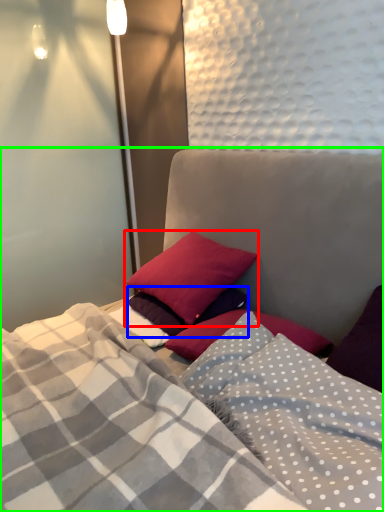
Question: Which is nearer to the pillow (highlighted by a red box)? pillow (highlighted by a blue box) or bed (highlighted by a green box).

Choices:
 (A) pillow
 (B) bed

Answer: (A)